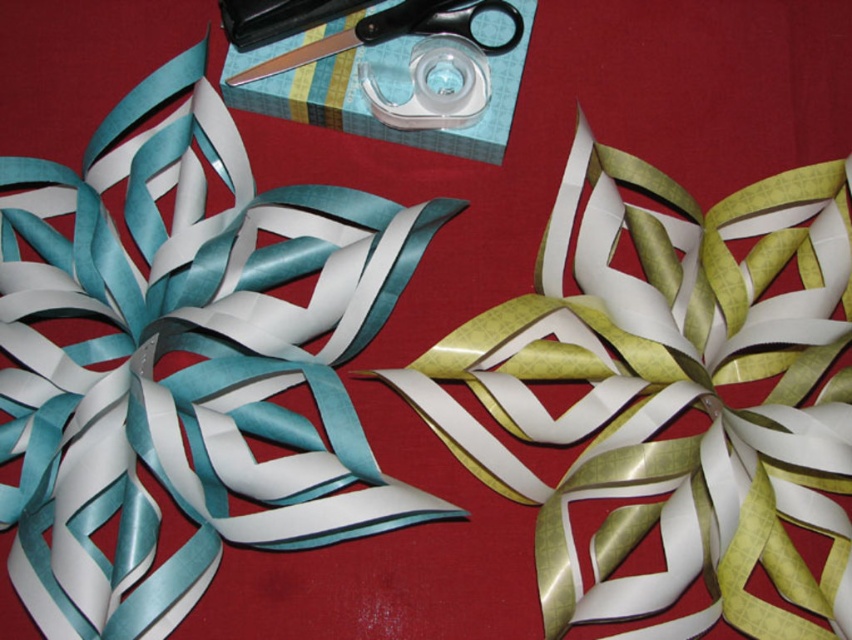
You are organizing a craft kit and need to place the gold shiny ribbon at center and the black plastic scissors at upper center into a storage box. If the scissors require a space of 10 cm, will the ribbon fit in the remaining space?

The gold shiny ribbon at center is larger than the black plastic scissors at upper center. Since the scissors need 10 cm, the ribbon would require more space, so it might not fit in the remaining space unless the box is sufficiently large.

Consider the image. You are a craft enthusiast holding a pair of scissors and want to cut the gold shiny ribbon at center. If you are standing 3.61 feet away from the ribbon, can you reach it without moving closer?

The gold shiny ribbon at center is 3.61 feet away from the viewer. Since the average human arm length is about 2.5 feet, you cannot reach the ribbon without moving closer.

You are looking at the crafting setup and want to place a new tool between the two points, point (643, 320) and point (499, 12). Based on their positions, which point should the tool be closer to if it needs to be placed in front of both?

The tool should be placed closer to point (643, 320) because it is in front of point (499, 12).